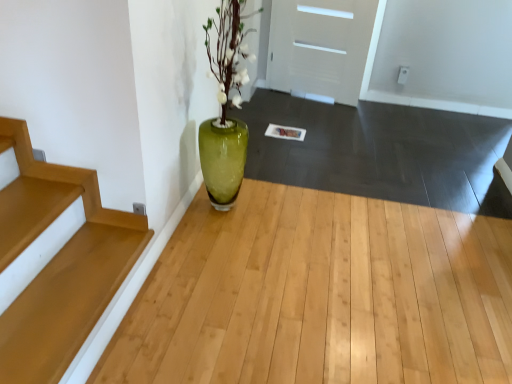
Question: Which is correct: wooden stairs at lower left is inside white matte door at upper center, or outside of it?

Choices:
 (A) outside
 (B) inside

Answer: (A)

Question: Looking at the image, does wooden stairs at lower left seem bigger or smaller compared to white matte door at upper center?

Choices:
 (A) big
 (B) small

Answer: (B)

Question: Estimate the real-world distances between objects in this image. Which object is closer to the white matte door at upper center?

Choices:
 (A) wooden stairs at lower left
 (B) green glass vase at center

Answer: (B)

Question: Considering the real-world distances, which object is farthest from the wooden stairs at lower left?

Choices:
 (A) green glass vase at center
 (B) white matte door at upper center

Answer: (B)